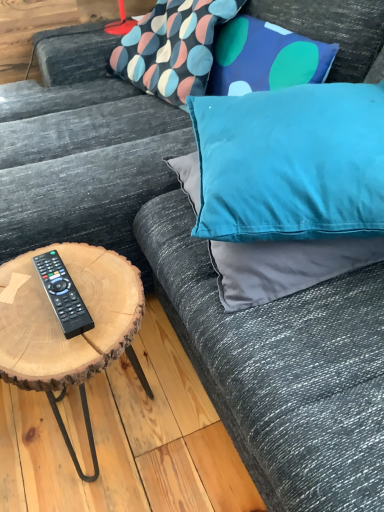
Question: Which direction should I rotate to face textured fabric pillow at upper center, arranged as the third pillow when ordered from the bottom, — up or down?

Choices:
 (A) up
 (B) down

Answer: (A)

Question: Can you confirm if velvet blue pillow at upper right is positioned to the left of natural wood coffee table at left?

Choices:
 (A) no
 (B) yes

Answer: (A)

Question: Can you confirm if velvet blue pillow at upper right is thinner than natural wood coffee table at left?

Choices:
 (A) no
 (B) yes

Answer: (A)

Question: Is velvet blue pillow at upper right aimed at natural wood coffee table at left?

Choices:
 (A) no
 (B) yes

Answer: (B)

Question: Considering the relative positions of velvet blue pillow at upper right and natural wood coffee table at left in the image provided, is velvet blue pillow at upper right to the right of natural wood coffee table at left from the viewer's perspective?

Choices:
 (A) no
 (B) yes

Answer: (B)

Question: Is velvet blue pillow at upper right facing away from natural wood coffee table at left?

Choices:
 (A) no
 (B) yes

Answer: (A)

Question: From a real-world perspective, is velvet blue pillow at upper right under natural wood coffee table at left?

Choices:
 (A) yes
 (B) no

Answer: (B)

Question: Are teal satin pillow at upper right, which is the second pillow in bottom-to-top order, and natural wood coffee table at left located far from each other?

Choices:
 (A) no
 (B) yes

Answer: (A)

Question: Is teal satin pillow at upper right, which is the second pillow in bottom-to-top order, bigger than natural wood coffee table at left?

Choices:
 (A) no
 (B) yes

Answer: (B)

Question: From the image's perspective, would you say teal satin pillow at upper right, which is the second pillow in bottom-to-top order, is positioned over natural wood coffee table at left?

Choices:
 (A) no
 (B) yes

Answer: (B)

Question: Is teal satin pillow at upper right, which appears as the second pillow when viewed from the top, at the left side of natural wood coffee table at left?

Choices:
 (A) yes
 (B) no

Answer: (B)

Question: Can you confirm if teal satin pillow at upper right, which is the second pillow in bottom-to-top order, is wider than natural wood coffee table at left?

Choices:
 (A) yes
 (B) no

Answer: (A)

Question: Is teal satin pillow at upper right, which is the second pillow in bottom-to-top order, turned away from natural wood coffee table at left?

Choices:
 (A) no
 (B) yes

Answer: (A)

Question: Does natural wood coffee table at left have a greater width compared to teal fabric pillow at upper right, which is counted as the first pillow, starting from the bottom?

Choices:
 (A) no
 (B) yes

Answer: (A)